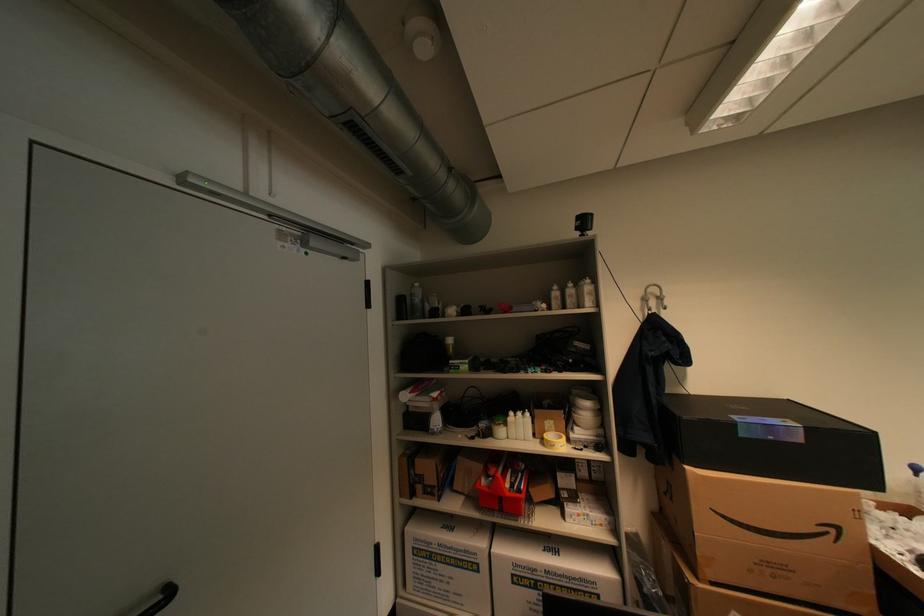
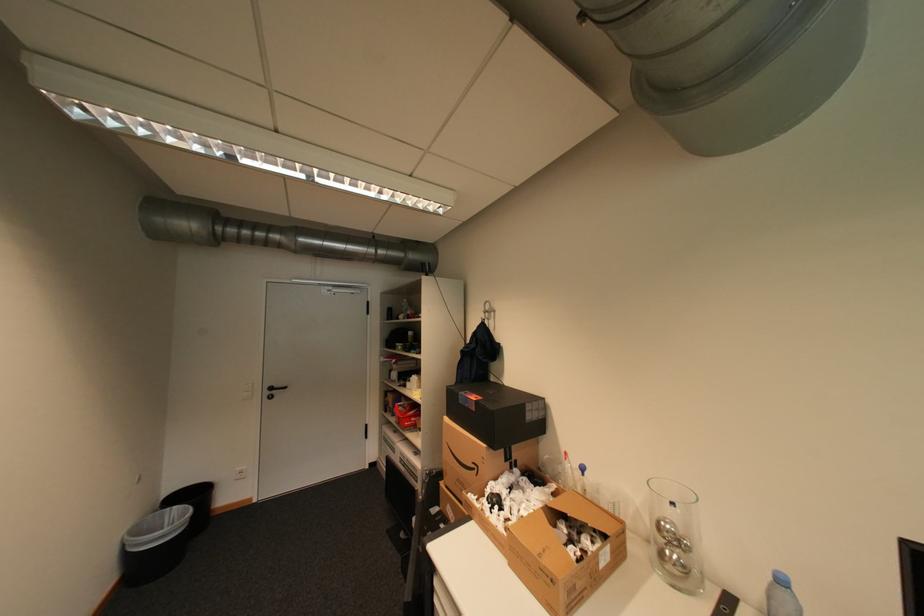
In the second image, find the point that corresponds to point 841,531 in the first image.

(484, 468)